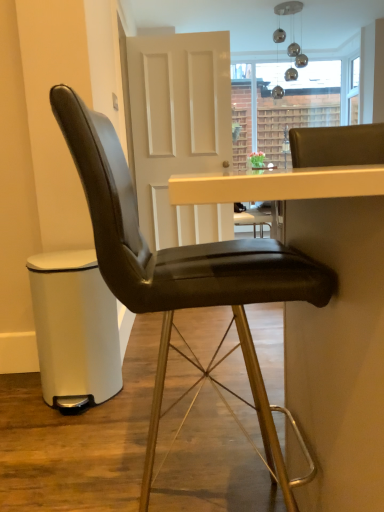
Question: Is black leather table at center bigger or smaller than black leather chair at center?

Choices:
 (A) small
 (B) big

Answer: (B)

Question: From their relative heights in the image, would you say black leather table at center is taller or shorter than black leather chair at center?

Choices:
 (A) short
 (B) tall

Answer: (A)

Question: Which object is positioned farthest from the black leather table at center?

Choices:
 (A) white matte door at center
 (B) black leather chair at center
 (C) matte black bar stool at lower left

Answer: (A)

Question: Considering the real-world distances, which object is farthest from the white matte door at center?

Choices:
 (A) matte black bar stool at lower left
 (B) black leather table at center
 (C) black leather chair at center

Answer: (B)